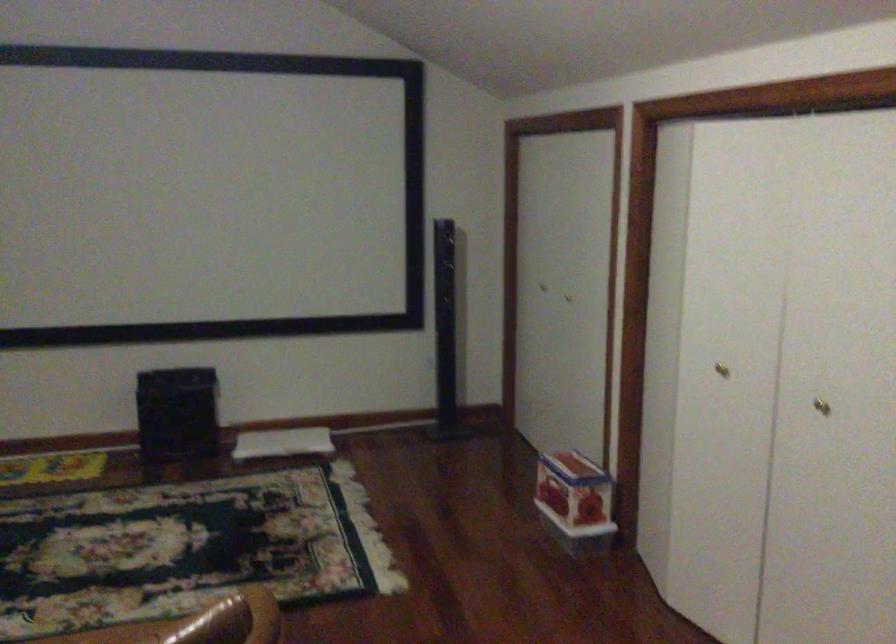
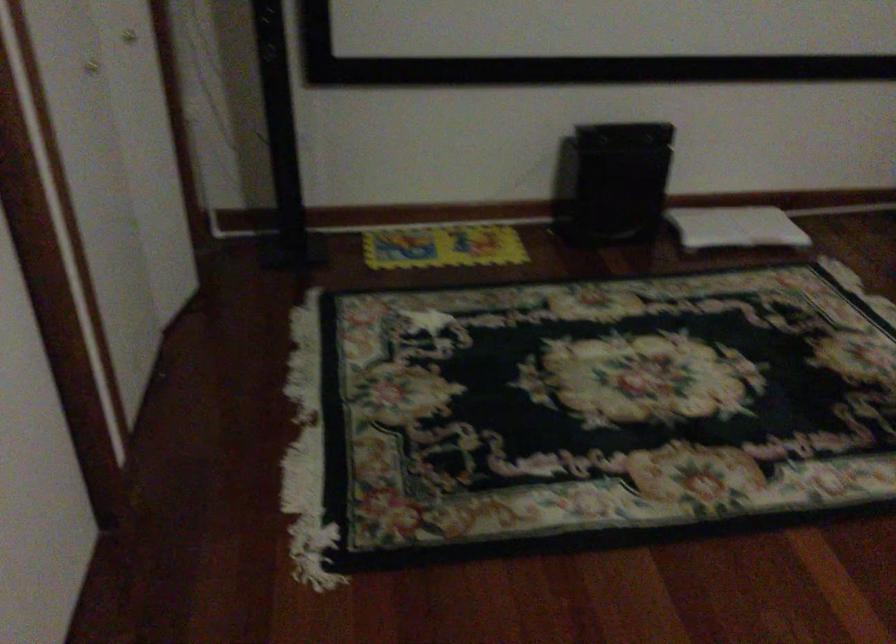
In the second image, find the point that corresponds to point 264,446 in the first image.

(735, 227)